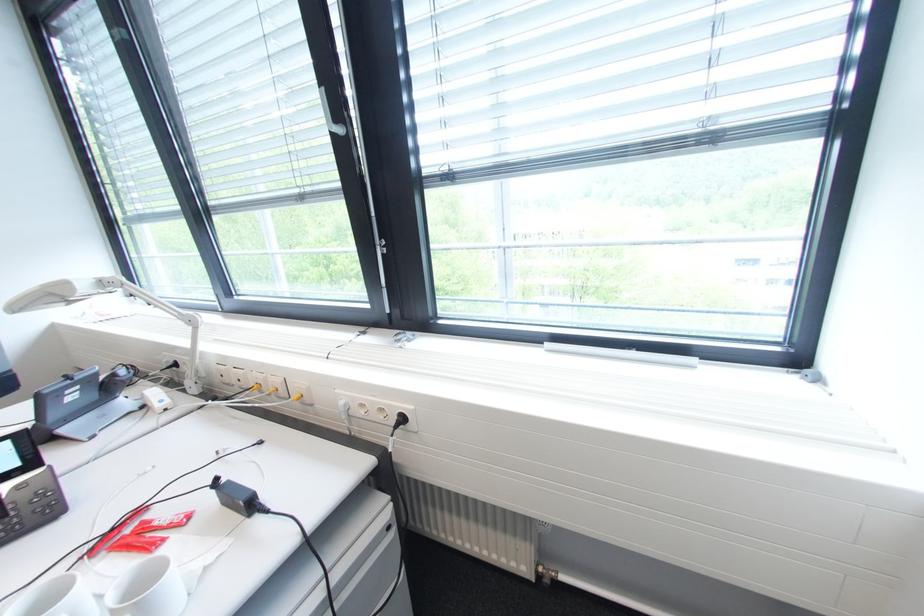
This screenshot has width=924, height=616. I want to click on black power plug, so click(398, 422).